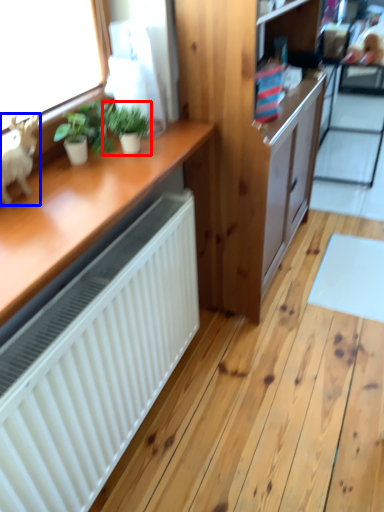
Question: Which object is closer to the camera taking this photo, houseplant (highlighted by a red box) or animal (highlighted by a blue box)?

Choices:
 (A) houseplant
 (B) animal

Answer: (B)